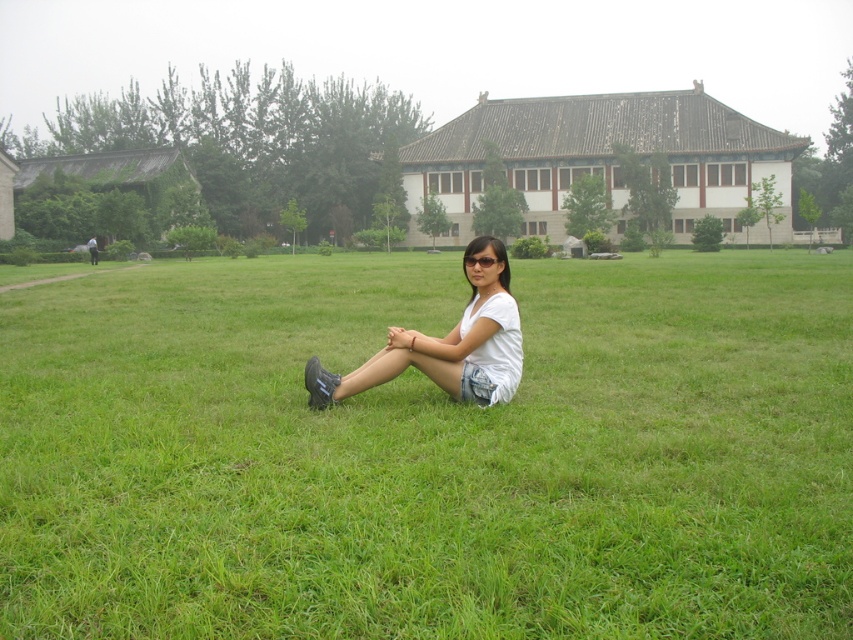
Question: Which point is closer to the camera?

Choices:
 (A) (337, 387)
 (B) (846, 577)

Answer: (B)

Question: Is green grass at center above white cotton shirt at center?

Choices:
 (A) no
 (B) yes

Answer: (B)

Question: Where is green grass at center located in relation to white cotton shirt at center in the image?

Choices:
 (A) left
 (B) right

Answer: (A)

Question: Does green grass at center have a lesser width compared to white cotton shirt at center?

Choices:
 (A) yes
 (B) no

Answer: (B)